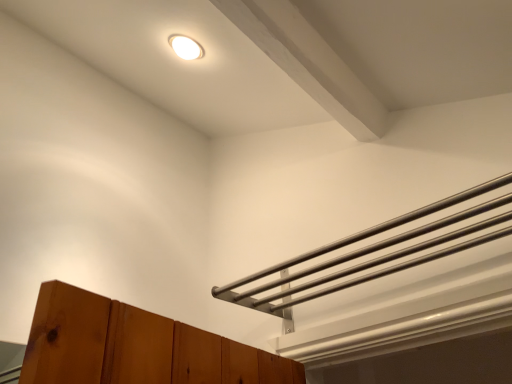
Locate an element on the screen. The image size is (512, 384). polished metal stairs at upper center is located at coordinates (373, 255).

The width and height of the screenshot is (512, 384). What do you see at coordinates (373, 255) in the screenshot?
I see `polished metal stairs at upper center` at bounding box center [373, 255].

Consider the image. Measure the distance between polished metal stairs at upper center and camera.

The distance of polished metal stairs at upper center from camera is 28.88 inches.

You are a GUI agent. You are given a task and a screenshot of the screen. Output one action in this format:
    pyautogui.click(x=<x>, y=<y>)
    Task: Click on the polished metal stairs at upper center
    The height and width of the screenshot is (384, 512).
    Given the screenshot: What is the action you would take?
    pyautogui.click(x=373, y=255)